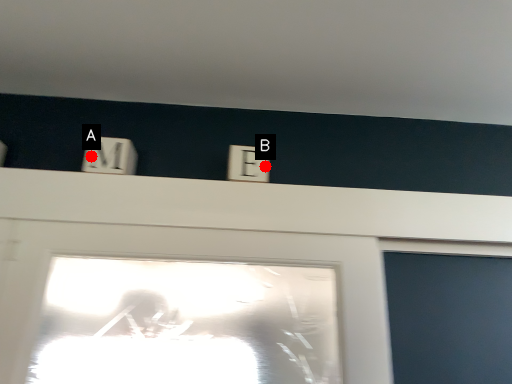
Question: Two points are circled on the image, labeled by A and B beside each circle. Which point is farther from the camera taking this photo?

Choices:
 (A) A is further
 (B) B is further

Answer: (B)